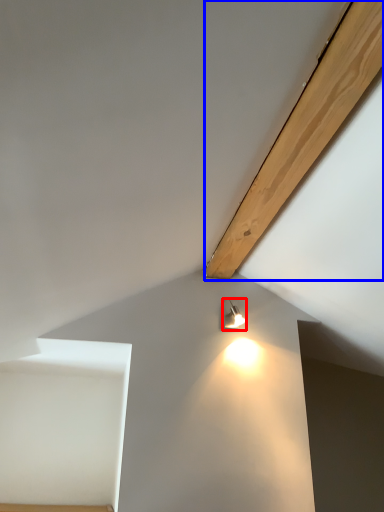
Question: Which point is further to the camera, lamp (highlighted by a red box) or plywood (highlighted by a blue box)?

Choices:
 (A) lamp
 (B) plywood

Answer: (A)